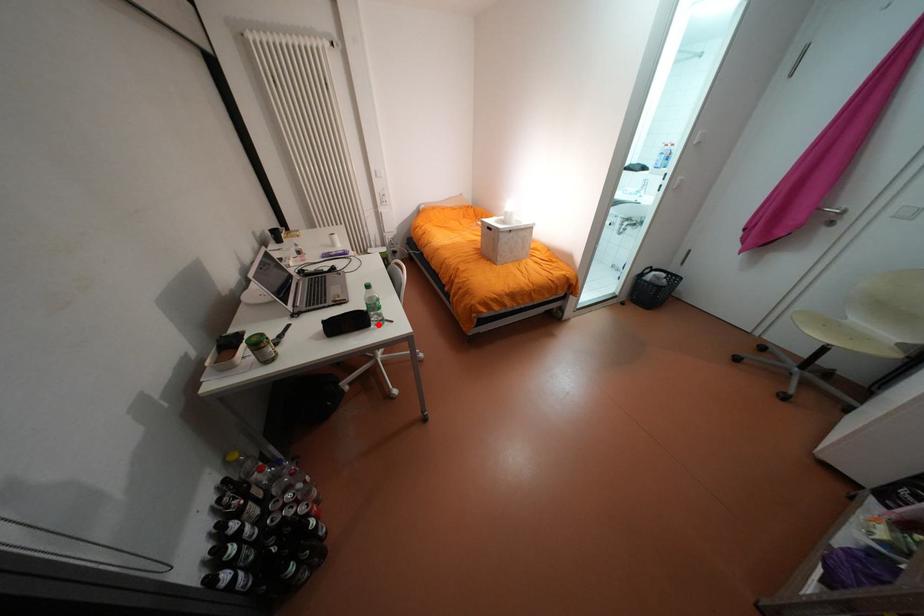
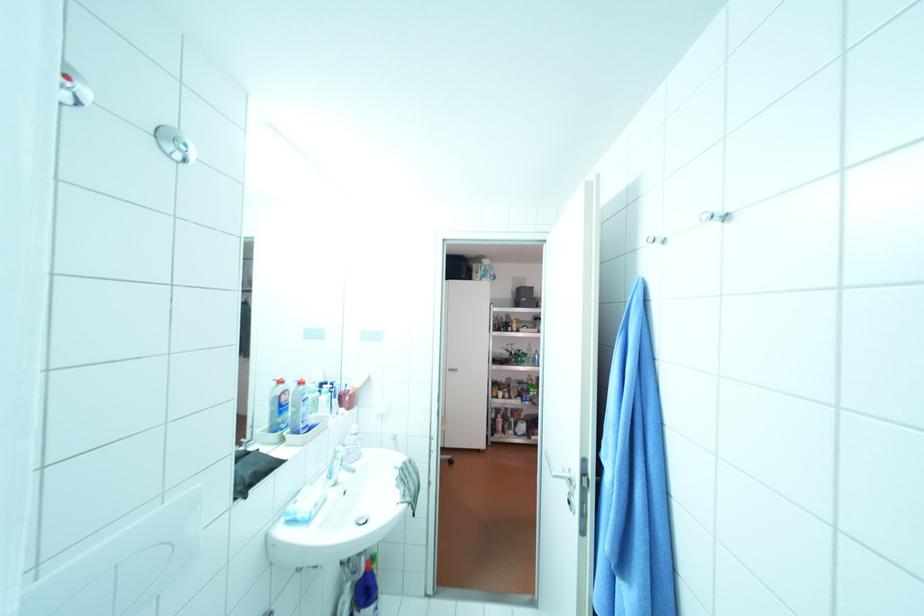
Question: I am providing you with two images of the same scene from different viewpoints. A red point is marked on the first image. At the location where the point appears in image 1, is it still visible in image 2?

Choices:
 (A) Yes
 (B) No

Answer: (B)